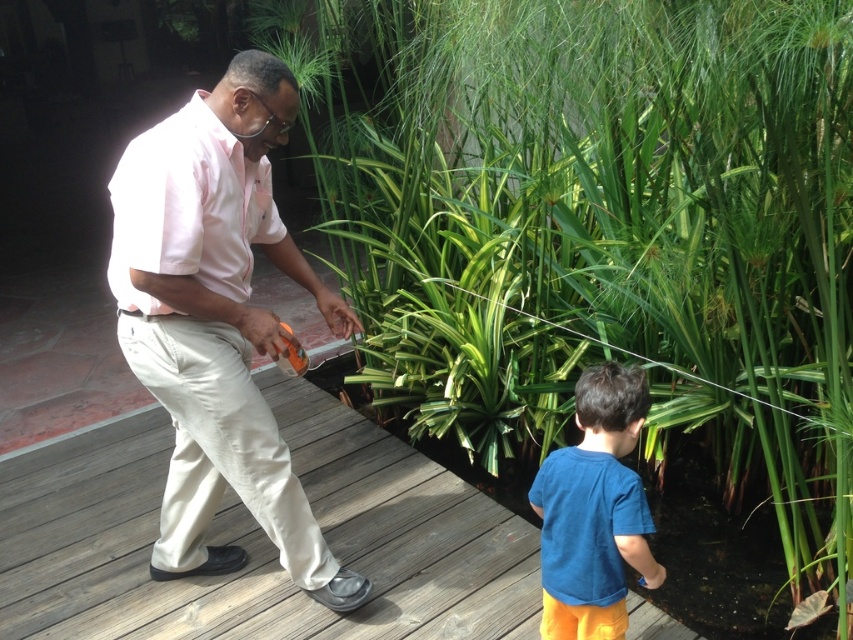
Is wooden deck at center wider than pink cotton shirt at left?

Yes.

Does wooden deck at center have a lesser height compared to pink cotton shirt at left?

Yes.

Where is `wooden deck at center`? wooden deck at center is located at coordinates (260, 540).

At what (x,y) coordinates should I click in order to perform the action: click on wooden deck at center. Please return your answer as a coordinate pair (x, y). The image size is (853, 640). Looking at the image, I should click on (260, 540).

Is green leafy plant at center smaller than wooden deck at center?

No.

Locate an element on the screen. green leafy plant at center is located at coordinates tap(598, 225).

Who is lower down, pink cotton shirt at left or blue cotton shirt at lower right?

Positioned lower is blue cotton shirt at lower right.

Is pink cotton shirt at left above blue cotton shirt at lower right?

Indeed, pink cotton shirt at left is positioned over blue cotton shirt at lower right.

Which is in front, point (189, 522) or point (589, 452)?

Point (589, 452) is more forward.

Identify the location of pink cotton shirt at left. (218, 321).